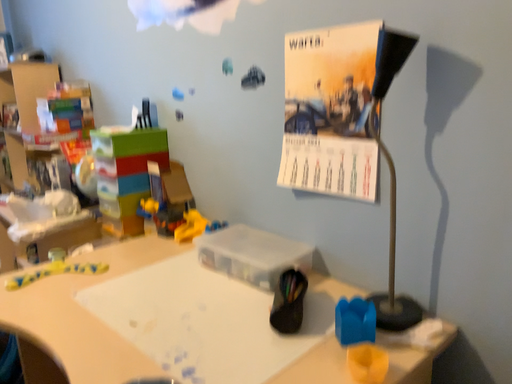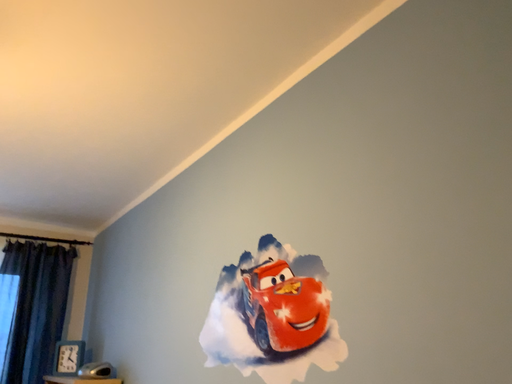
Question: Which way did the camera rotate in the video?

Choices:
 (A) rotated downward
 (B) rotated upward

Answer: (B)